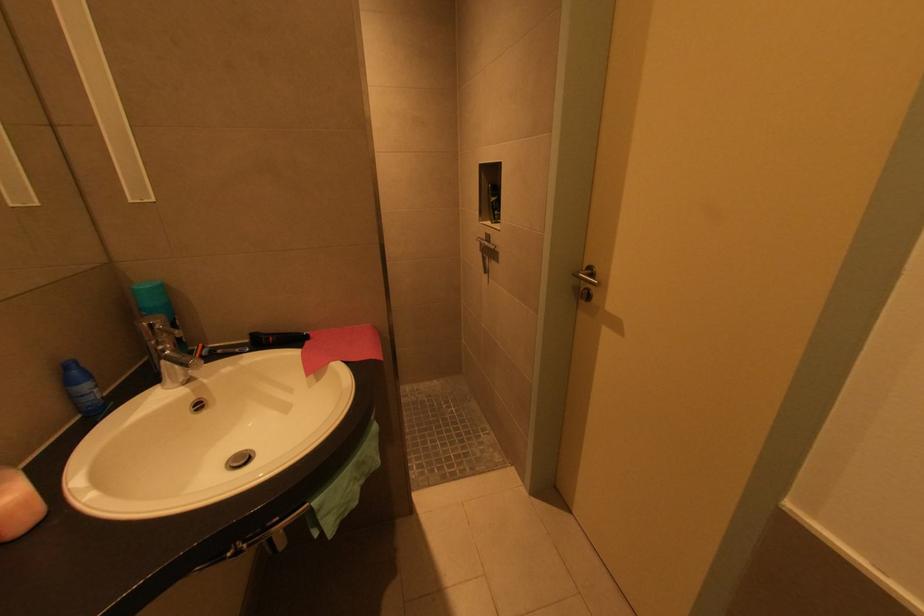
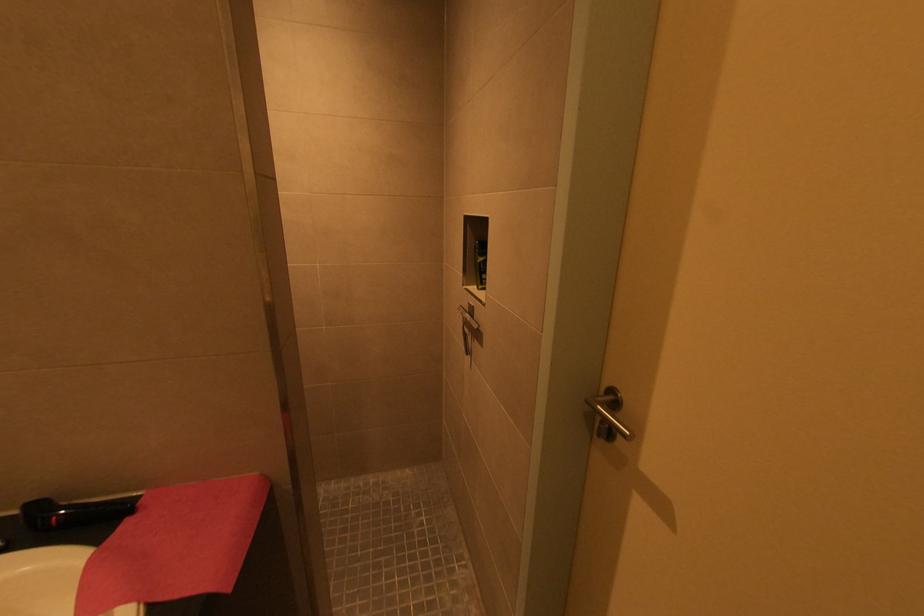
Question: What movement of the cameraman would produce the second image?

Choices:
 (A) Left
 (B) Right
 (C) Forward
 (D) Backward

Answer: (C)